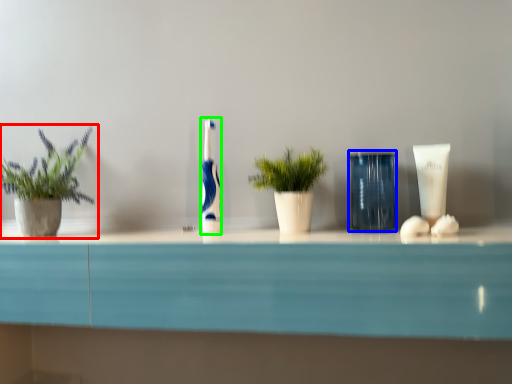
Question: Estimate the real-world distances between objects in this image. Which object is farther from houseplant (highlighted by a red box), glass vase (highlighted by a blue box) or toothbrush (highlighted by a green box)?

Choices:
 (A) glass vase
 (B) toothbrush

Answer: (A)